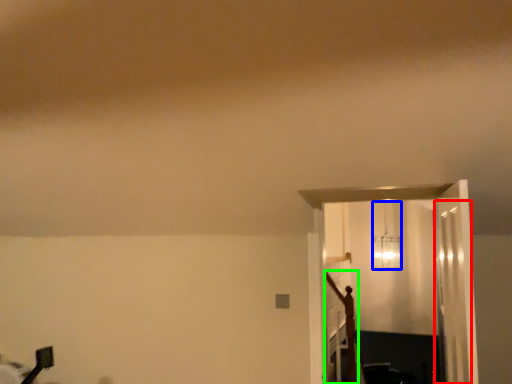
Question: Which is farther away from glass door (highlighted by a red box)? lamp (highlighted by a blue box) or crucifix (highlighted by a green box)?

Choices:
 (A) lamp
 (B) crucifix

Answer: (A)